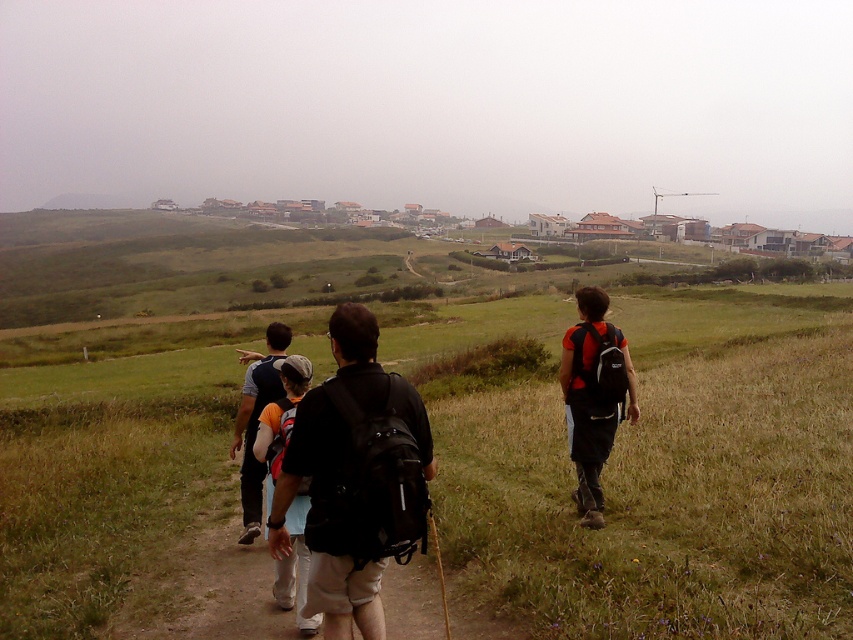
Can you confirm if matte black backpack at center is positioned to the right of black fabric backpack at right?

In fact, matte black backpack at center is to the left of black fabric backpack at right.

Between point (401, 483) and point (592, 342), which one is positioned in front?

Positioned in front is point (401, 483).

Is point (370, 522) positioned before point (608, 365)?

That is True.

Identify the location of matte black backpack at center. Image resolution: width=853 pixels, height=640 pixels. (367, 465).

Who is more distant from viewer, (358, 600) or (602, 317)?

Positioned behind is point (602, 317).

Does point (338, 429) come closer to viewer compared to point (573, 419)?

Yes, point (338, 429) is closer to viewer.

Who is more distant from viewer, (285,454) or (572,385)?

The point (572,385) is behind.

Where is `black backpack at center`? The image size is (853, 640). black backpack at center is located at coordinates (355, 477).

Is point (367, 456) behind point (369, 412)?

No, it is not.

Describe the element at coordinates (355, 477) in the screenshot. This screenshot has width=853, height=640. I see `black backpack at center` at that location.

Where is `black backpack at center`? This screenshot has height=640, width=853. black backpack at center is located at coordinates (355, 477).